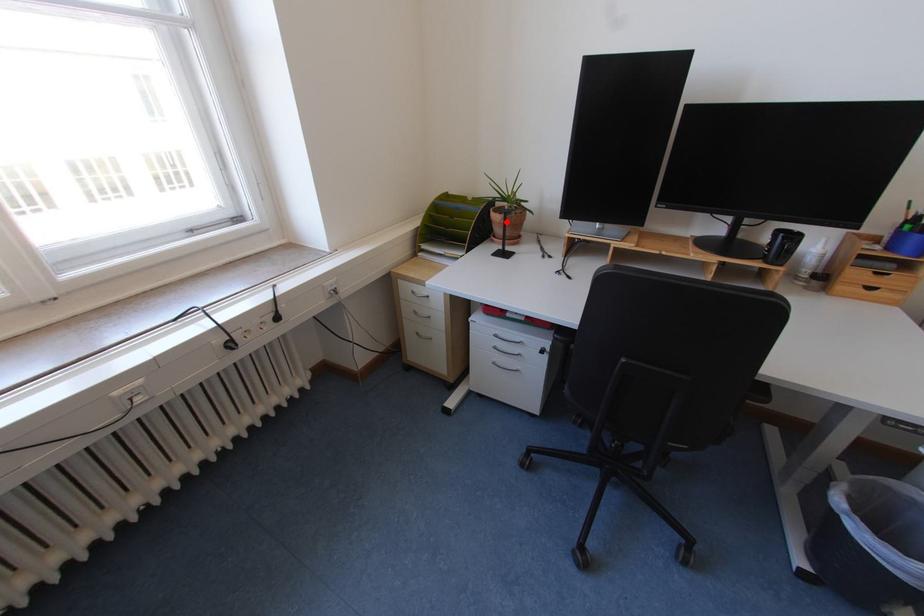
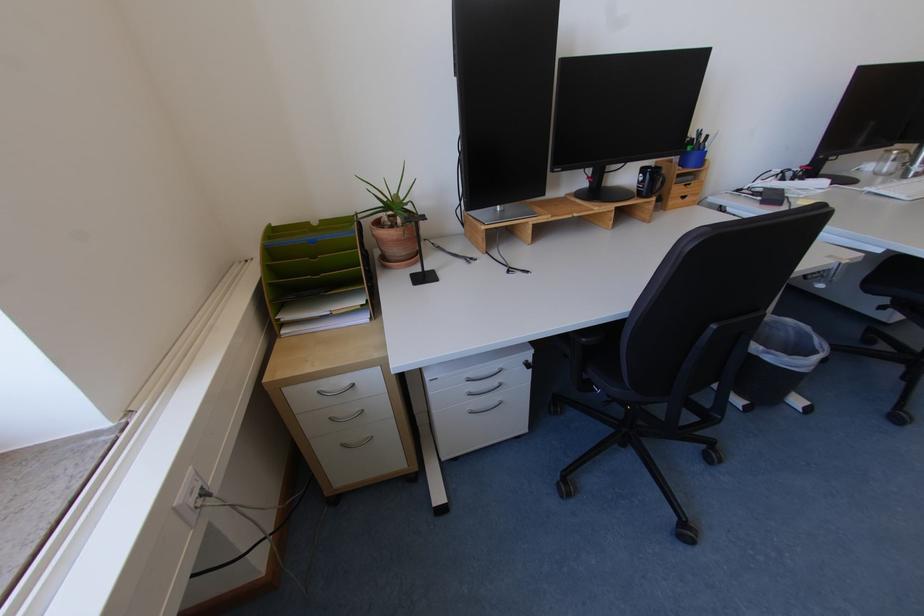
The point at the highlighted location is marked in the first image. Where is the corresponding point in the second image?

(403, 238)